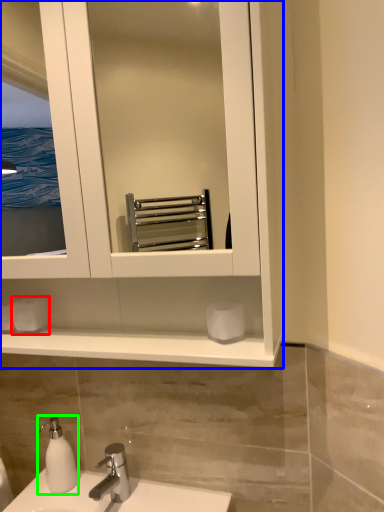
Question: Based on their relative distances, which object is farther from toilet paper (highlighted by a red box)? Choose from bathroom cabinet (highlighted by a blue box) and soap dispenser (highlighted by a green box).

Choices:
 (A) bathroom cabinet
 (B) soap dispenser

Answer: (A)